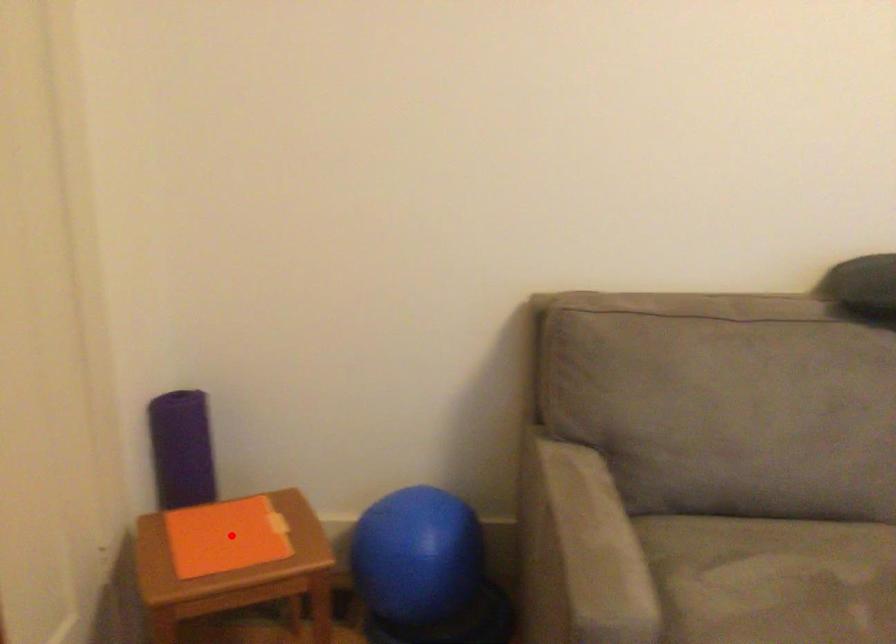
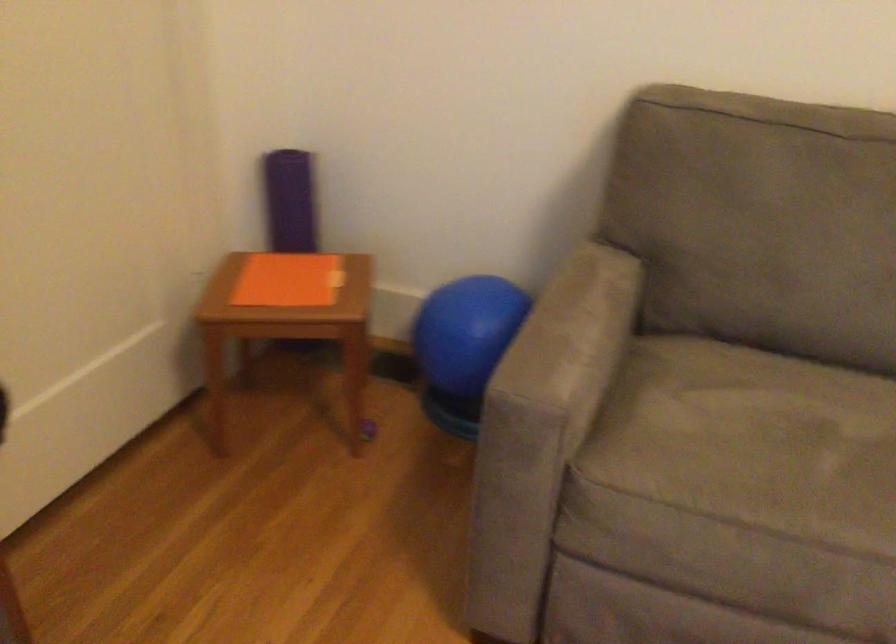
Question: I am providing you with two images of the same scene from different viewpoints. In image1, a red point is highlighted. Considering the same 3D point in image2, which of the following is correct?

Choices:
 (A) It is closer
 (B) It is farther

Answer: (B)